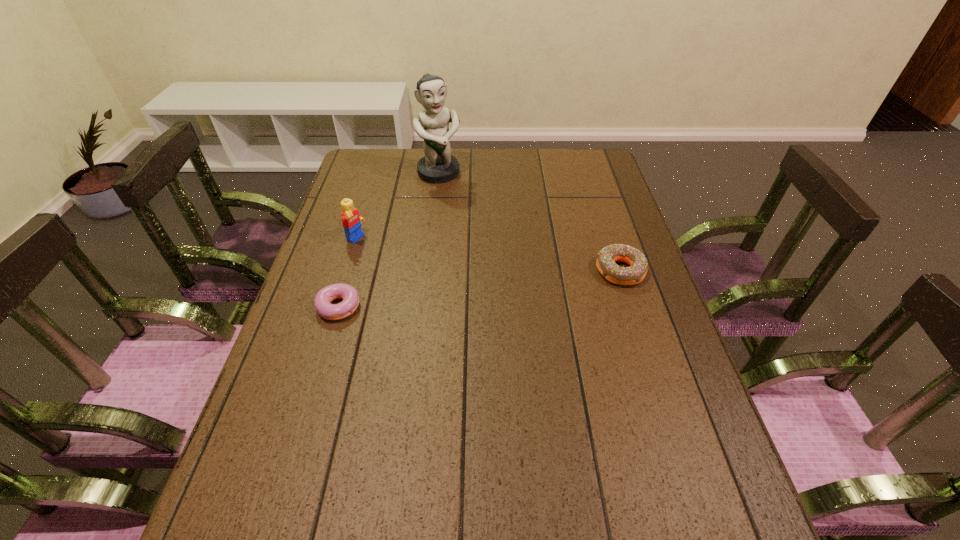
This screenshot has width=960, height=540. I want to click on vacant point that satisfies the following two spatial constraints: 1. on the back side of the second shortest object; 2. on the left side of the shortest object, so (x=349, y=271).

This screenshot has width=960, height=540. I want to click on free location that satisfies the following two spatial constraints: 1. on the back side of the left doughnut; 2. on the right side of the second object from right to left, so (378, 173).